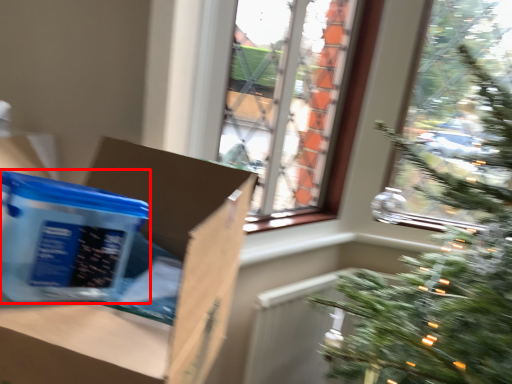
Question: Considering the relative positions of cardboard box (annotated by the red box) and cardboard box in the image provided, where is cardboard box (annotated by the red box) located with respect to the staircase?

Choices:
 (A) left
 (B) right

Answer: (A)